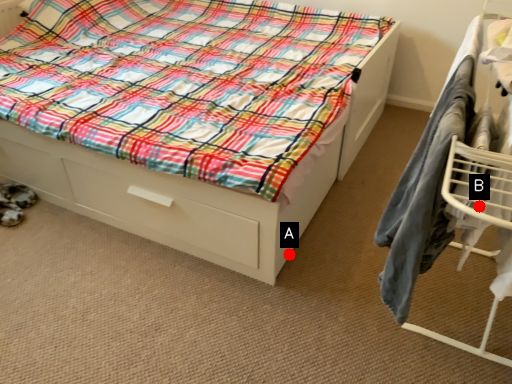
Question: Two points are circled on the image, labeled by A and B beside each circle. Which point appears farthest from the camera in this image?

Choices:
 (A) A is further
 (B) B is further

Answer: (A)